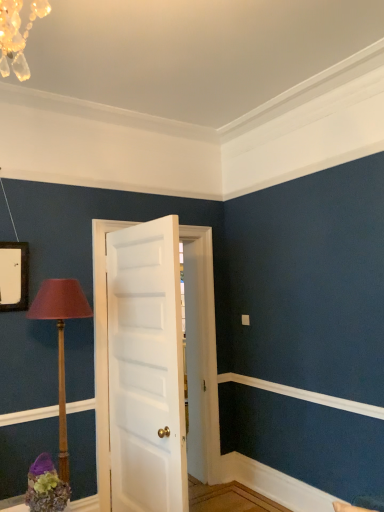
Based on the photo, measure the distance between wooden table lamp at left and camera.

8.38 feet.

This screenshot has height=512, width=384. Describe the element at coordinates (60, 341) in the screenshot. I see `wooden table lamp at left` at that location.

Find the location of `wooden table lamp at left`. wooden table lamp at left is located at coordinates (60, 341).

At what (x,y) coordinates should I click in order to perform the action: click on white matte door at center. Please return your answer as a coordinate pair (x, y). The width and height of the screenshot is (384, 512). Looking at the image, I should click on (102, 354).

This screenshot has height=512, width=384. Describe the element at coordinates (102, 354) in the screenshot. I see `white matte door at center` at that location.

Locate an element on the screen. Image resolution: width=384 pixels, height=512 pixels. wooden table lamp at left is located at coordinates (60, 341).

Which is more to the right, white matte door at center or wooden table lamp at left?

white matte door at center.

Which object is more forward, white matte door at center or wooden table lamp at left?

wooden table lamp at left is more forward.

Which is behind, point (102, 444) or point (59, 453)?

The point (102, 444) is more distant.

From the image's perspective, is white matte door at center located beneath wooden table lamp at left?

No, from the image's perspective, white matte door at center is not beneath wooden table lamp at left.

From a real-world perspective, is white matte door at center on top of wooden table lamp at left?

Yes, from a real-world perspective, white matte door at center is over wooden table lamp at left

Which of these two, white matte door at center or wooden table lamp at left, is wider?

wooden table lamp at left.

Considering the sizes of objects white matte door at center and wooden table lamp at left in the image provided, who is taller, white matte door at center or wooden table lamp at left?

white matte door at center is taller.

From the picture: Considering the sizes of objects white matte door at center and wooden table lamp at left in the image provided, who is smaller, white matte door at center or wooden table lamp at left?

wooden table lamp at left.

Is wooden table lamp at left a part of white matte door at center?

No, wooden table lamp at left is not surrounded by white matte door at center.

Is white matte door at center next to wooden table lamp at left and touching it?

There is a gap between white matte door at center and wooden table lamp at left.

Based on the photo, is white matte door at center oriented towards wooden table lamp at left?

Yes, white matte door at center faces towards wooden table lamp at left.

Image resolution: width=384 pixels, height=512 pixels. What are the coordinates of `door that is above the wooden table lamp at left (from the image's perspective)` in the screenshot? It's located at (102, 354).

Between wooden table lamp at left and white matte door at center, which one appears on the right side from the viewer's perspective?

From the viewer's perspective, white matte door at center appears more on the right side.

Which is behind, wooden table lamp at left or white matte door at center?

Positioned behind is white matte door at center.

Does point (70, 305) appear closer or farther from the camera than point (103, 499)?

Point (70, 305).

From the image's perspective, is wooden table lamp at left located above or below white matte door at center?

From the image's perspective, wooden table lamp at left appears below white matte door at center.

From a real-world perspective, between wooden table lamp at left and white matte door at center, who is vertically lower?

wooden table lamp at left.

Which object is wider, wooden table lamp at left or white matte door at center?

Wider between the two is wooden table lamp at left.

Considering the sizes of wooden table lamp at left and white matte door at center in the image, is wooden table lamp at left taller or shorter than white matte door at center?

Clearly, wooden table lamp at left is shorter compared to white matte door at center.

Can you confirm if wooden table lamp at left is smaller than white matte door at center?

Yes, wooden table lamp at left is smaller than white matte door at center.

Consider the image. Which is correct: wooden table lamp at left is inside white matte door at center, or outside of it?

wooden table lamp at left is not enclosed by white matte door at center.

Is there a large distance between wooden table lamp at left and white matte door at center?

wooden table lamp at left is actually quite close to white matte door at center.

Could you tell me if wooden table lamp at left is facing white matte door at center?

No, wooden table lamp at left is not facing towards white matte door at center.

Where is `door on the right of the wooden table lamp at left`? door on the right of the wooden table lamp at left is located at coordinates click(x=102, y=354).

Image resolution: width=384 pixels, height=512 pixels. I want to click on table lamp in front of the white matte door at center, so click(60, 341).

At what (x,y) coordinates should I click in order to perform the action: click on door on the right of the wooden table lamp at left. Please return your answer as a coordinate pair (x, y). Looking at the image, I should click on (102, 354).